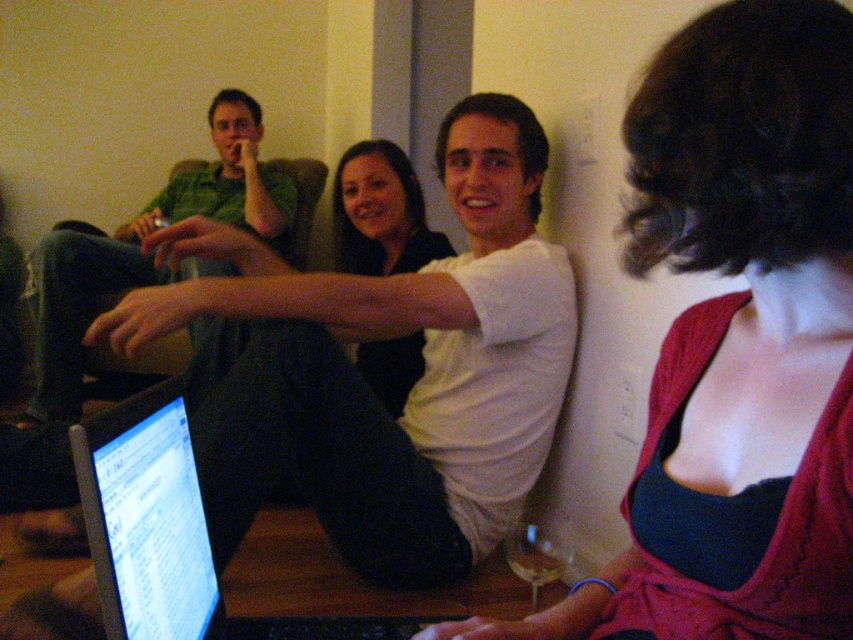
Who is more distant from viewer, (148, 490) or (224, 124)?

Point (224, 124)

Is point (183, 465) farther from viewer compared to point (68, 484)?

No, it is in front of (68, 484).

The image size is (853, 640). I want to click on silver glossy laptop at center, so click(x=171, y=534).

Which is above, matte red dress at center or matte black shirt at center?

matte black shirt at center

Describe the element at coordinates (737, 340) in the screenshot. I see `matte red dress at center` at that location.

Image resolution: width=853 pixels, height=640 pixels. I want to click on matte red dress at center, so click(737, 340).

Is white matte laptop at center shorter than silver glossy laptop at center?

No, white matte laptop at center is not shorter than silver glossy laptop at center.

Can you confirm if white matte laptop at center is positioned to the left of silver glossy laptop at center?

In fact, white matte laptop at center is to the right of silver glossy laptop at center.

I want to click on white matte laptop at center, so click(369, 387).

At what (x,y) coordinates should I click in order to perform the action: click on white matte laptop at center. Please return your answer as a coordinate pair (x, y). Looking at the image, I should click on (369, 387).